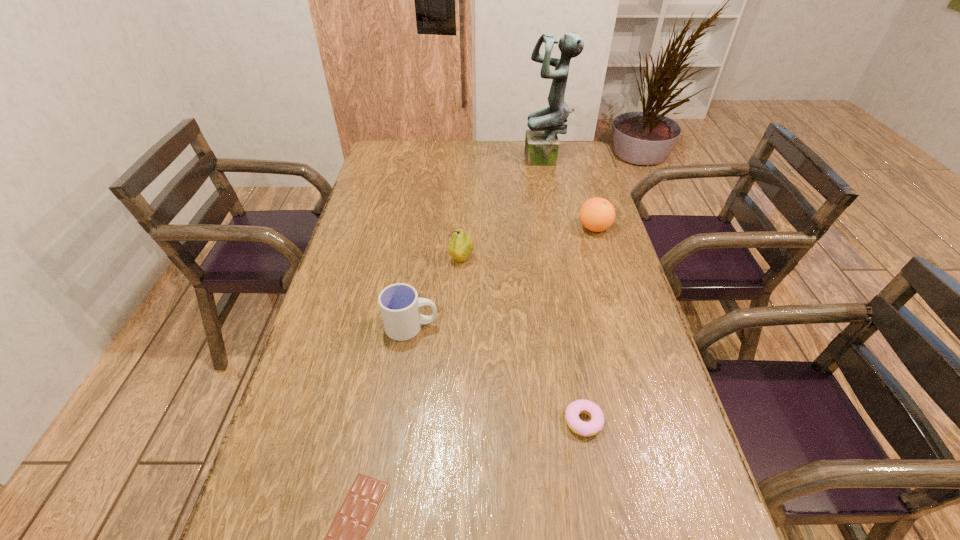
This screenshot has height=540, width=960. Identify the location of object that ranks as the second closest to the fourth object from right to left. (597, 214).

The width and height of the screenshot is (960, 540). I want to click on vacant space that satisfies the following two spatial constraints: 1. on the face of the orange; 2. on the left side of the tallest object, so click(x=560, y=228).

I want to click on vacant space that satisfies the following two spatial constraints: 1. on the back side of the doughnut; 2. with the handle on the side of the fourth farthest object, so click(566, 327).

In order to click on vacant space that satisfies the following two spatial constraints: 1. with the handle on the side of the cup; 2. on the back side of the second nearest object in this screenshot , I will do `click(398, 422)`.